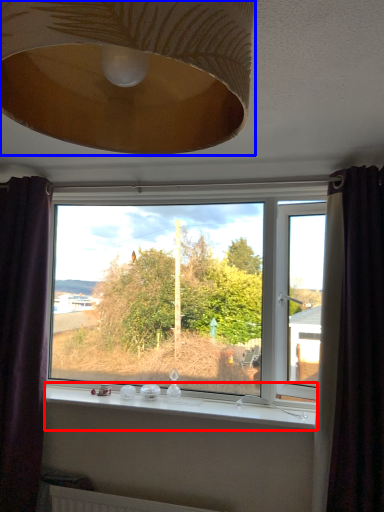
Question: Among these objects, which one is farthest to the camera, window sill (highlighted by a red box) or lamp (highlighted by a blue box)?

Choices:
 (A) window sill
 (B) lamp

Answer: (A)